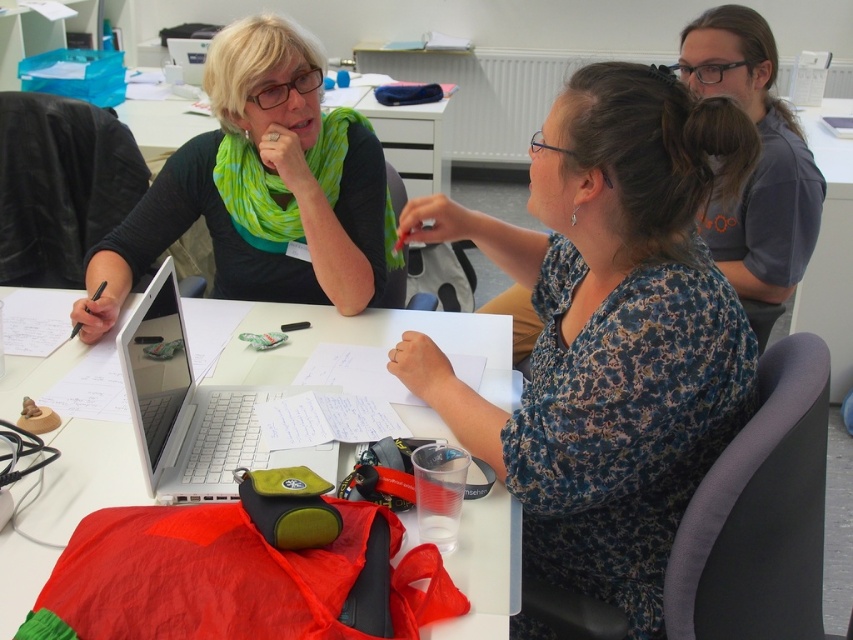
Is matte black laptop at left behind white plastic table at upper center?

No, it is in front of white plastic table at upper center.

Does matte black laptop at left appear on the right side of white plastic table at upper center?

In fact, matte black laptop at left is to the left of white plastic table at upper center.

Which is in front, point (157, 218) or point (839, 300)?

Point (157, 218)

The width and height of the screenshot is (853, 640). I want to click on matte black laptop at left, so point(262,188).

Between white matte laptop at center and white plastic table at upper center, which one is positioned lower?

Positioned lower is white matte laptop at center.

Looking at this image, does white matte laptop at center appear on the right side of white plastic table at upper center?

No, white matte laptop at center is not to the right of white plastic table at upper center.

Who is more distant from viewer, (244, 394) or (837, 106)?

The point (837, 106) is more distant.

This screenshot has width=853, height=640. Find the location of `white matte laptop at center`. white matte laptop at center is located at coordinates (193, 410).

Can you confirm if floral dress at center is bigger than white matte laptop at center?

Indeed, floral dress at center has a larger size compared to white matte laptop at center.

Can you confirm if floral dress at center is positioned below white matte laptop at center?

No, floral dress at center is not below white matte laptop at center.

Is point (619, 113) positioned before point (227, 496)?

Yes, it is.

Locate an element on the screen. Image resolution: width=853 pixels, height=640 pixels. floral dress at center is located at coordinates (608, 332).